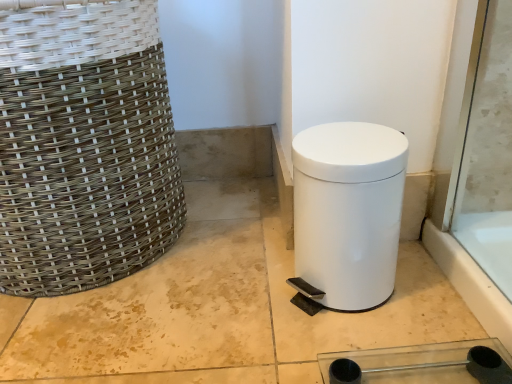
Identify the location of vacant space that is in between white woven basket at left and white glossy trash can at lower right. (217, 267).